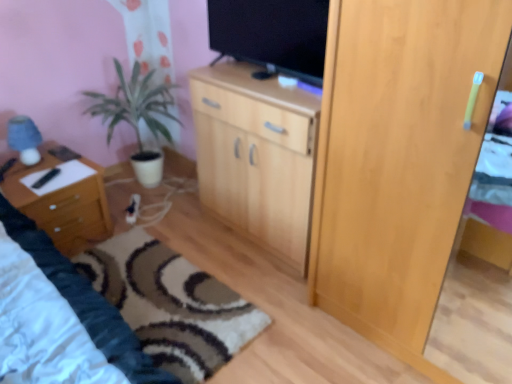
I want to click on vacant space that is to the left of wooden cabinet at center, so click(193, 230).